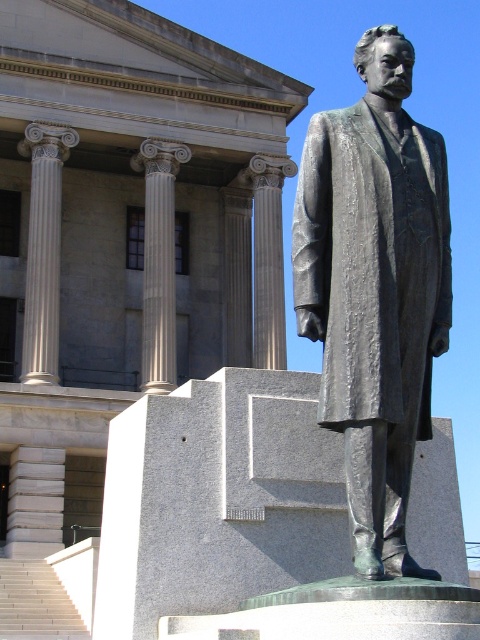
You are standing in front of the statue and want to take a photo with your smartphone. Your phone has a maximum focus range of 10 meters. Will you be able to focus on the bronze statue at center?

The bronze statue at center is 12.13 meters away from the viewer, which exceeds the phone camera maximum focus range of 10 meters. Therefore, the statue will be out of focus.

You are an architect planning to place a new statue between the white marble column at left and the sanded stone column at center. Based on their widths, which column should the statue be placed closer to for better balance?

The white marble column at left might be wider than the sanded stone column at center, so placing the statue closer to the narrower sanded stone column at center would help achieve better balance.

You are standing in front of the statue and want to know how far you are from the point marked at coordinates (339, 268). Can you determine the distance?

The point at coordinates (339, 268) is 43.56 feet away from the viewer.